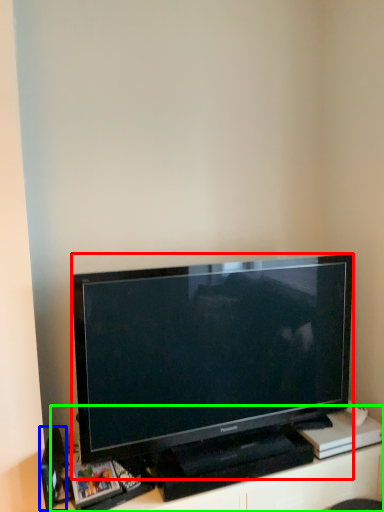
Question: Which is farther away from television (highlighted by a red box)? speaker (highlighted by a blue box) or entertainment center (highlighted by a green box)?

Choices:
 (A) speaker
 (B) entertainment center

Answer: (A)